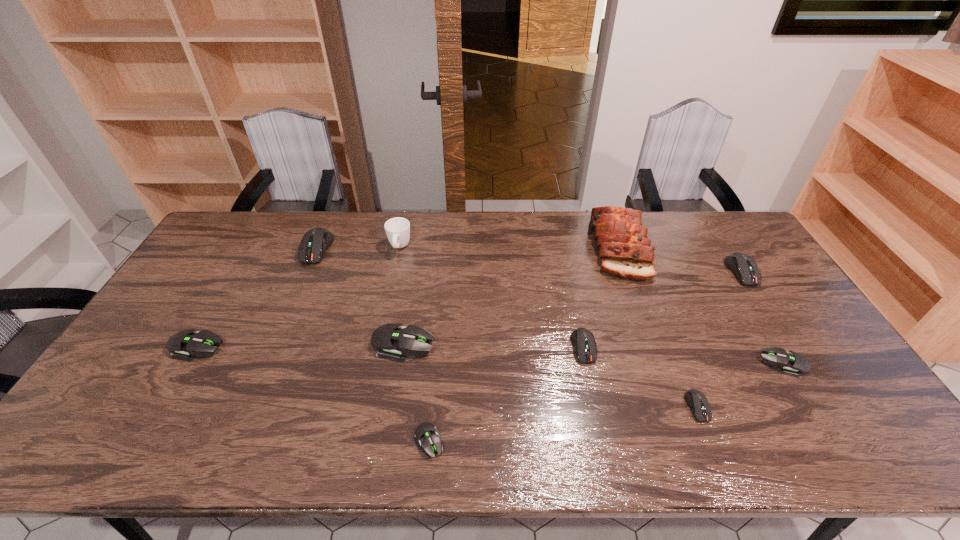
In order to click on the sixth computer mouse from left to right in this screenshot , I will do `click(696, 400)`.

This screenshot has width=960, height=540. Find the location of `the smallest dark computer equipment`. the smallest dark computer equipment is located at coordinates (696, 400).

Locate an element on the screen. the rightmost gray computer mouse is located at coordinates (793, 364).

The width and height of the screenshot is (960, 540). What are the coordinates of `the nearest object` in the screenshot? It's located at (427, 436).

This screenshot has height=540, width=960. Identify the location of the shortest computer mouse. (427, 436).

The height and width of the screenshot is (540, 960). What are the coordinates of `vacant region located 0.250m on the front of the bread` in the screenshot? It's located at (655, 346).

I want to click on free space located with the handle on the side of the ninth shortest object, so click(x=394, y=274).

Find the location of `free spot located on the button of the biggest dark computer equipment`. free spot located on the button of the biggest dark computer equipment is located at coordinates (305, 276).

Where is `blank space located on the button of the rightmost dark computer equipment`? blank space located on the button of the rightmost dark computer equipment is located at coordinates (766, 311).

Identify the location of vacant space located on the left of the biggest gray computer mouse. click(x=228, y=344).